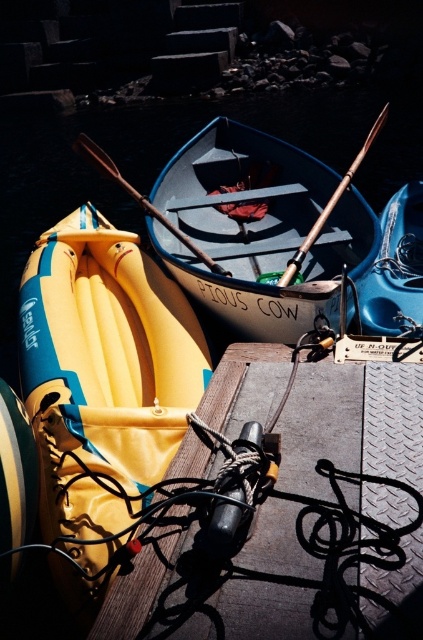
You are a visitor at the waterfront and want to know the position of the yellow fabric kayak at left relative to the matte blue canoe at center. Which one is lower?

The yellow fabric kayak at left is located below the matte blue canoe at center, so it is lower.

You are standing on the dock and want to retrieve an oar to use with the canoe named PIOUS COW. The oar is located at point (x=139, y=196). Can you reach the oar from your current position on the dock without stepping into the water?

The wooden oar at center is located at point (x=139, y=196), so yes, you can reach it while staying on the dock.